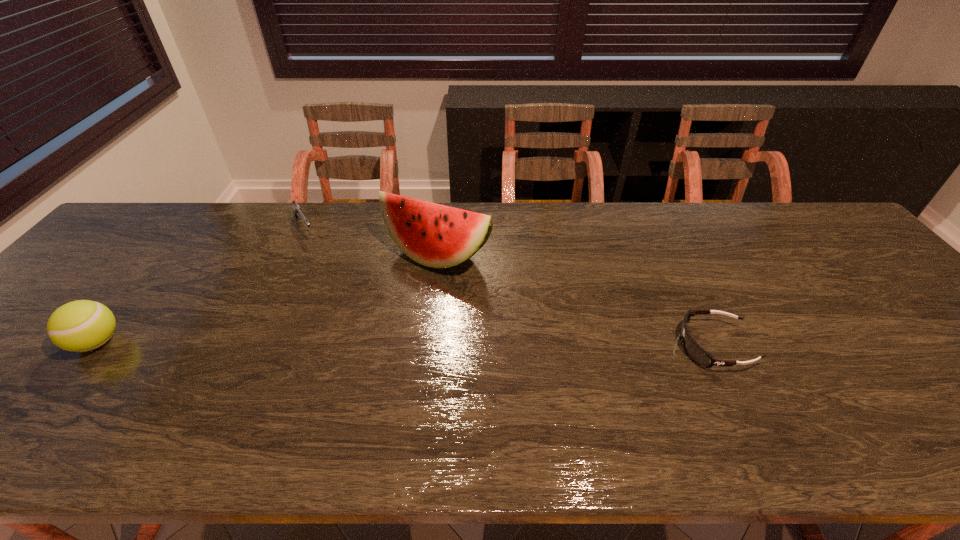
Where is `object located in the left edge section of the desktop`? The image size is (960, 540). object located in the left edge section of the desktop is located at coordinates (83, 325).

Find the location of a particular element. The height and width of the screenshot is (540, 960). vacant space at the far edge of the desktop is located at coordinates (751, 241).

Identify the location of blank space at the near edge of the desktop. click(79, 381).

What are the coordinates of `free space at the left edge` in the screenshot? It's located at (60, 290).

Image resolution: width=960 pixels, height=540 pixels. Find the location of `free space at the far right corner of the desktop`. free space at the far right corner of the desktop is located at coordinates (801, 211).

Where is `empty space that is in between the goggles and the pistol`? This screenshot has height=540, width=960. empty space that is in between the goggles and the pistol is located at coordinates (509, 287).

Identify the location of free space between the third object from right to left and the watermelon. The width and height of the screenshot is (960, 540). [x=371, y=242].

The width and height of the screenshot is (960, 540). Find the location of `vacant point located between the shortest object and the third object from right to left`. vacant point located between the shortest object and the third object from right to left is located at coordinates (509, 287).

Identify the location of free spot between the second tallest object and the second object from right to left. This screenshot has width=960, height=540. (267, 299).

You are a GUI agent. You are given a task and a screenshot of the screen. Output one action in this format:
    pyautogui.click(x=<x>, y=<y>)
    Task: Click on the free space between the second tallest object and the watermelon
    This screenshot has width=960, height=540.
    Given the screenshot: What is the action you would take?
    pyautogui.click(x=267, y=299)